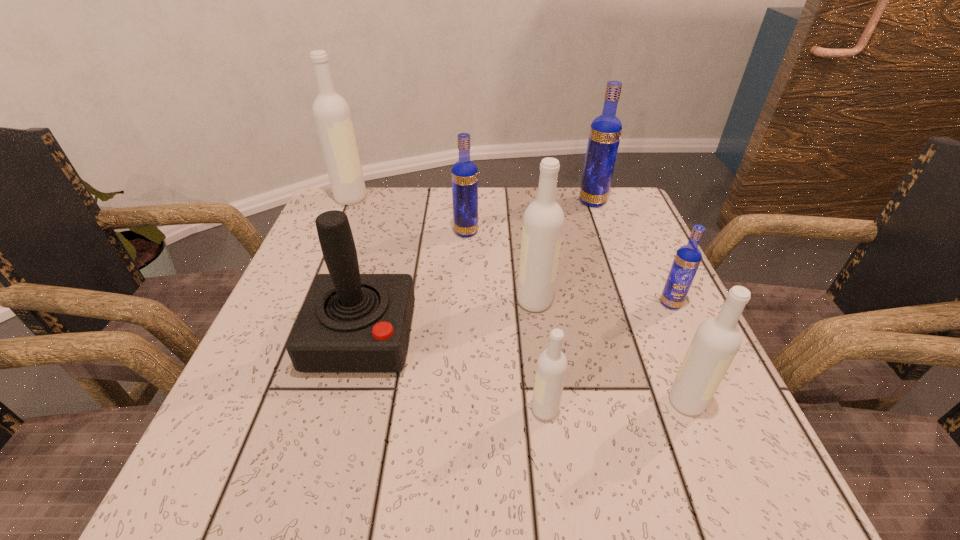
Locate an element on the screen. the rightmost blue vodka is located at coordinates [x=688, y=257].

Where is `the smallest white vodka`? the smallest white vodka is located at coordinates (551, 369).

At what (x,y) coordinates should I click in order to perform the action: click on blank space located 0.380m on the front of the tallest object. Please return your answer as a coordinate pair (x, y). Looking at the image, I should click on (302, 312).

Identify the location of vacant space located 0.210m on the front of the second blue vodka from left to right. (614, 261).

You are a GUI agent. You are given a task and a screenshot of the screen. Output one action in this format:
    pyautogui.click(x=<x>, y=<y>)
    Task: Click on the vacant area situated on the back of the second farthest white vodka
    Image resolution: width=960 pixels, height=540 pixels.
    Given the screenshot: What is the action you would take?
    pyautogui.click(x=525, y=232)

Where is `free space located on the base of the joystick`? The image size is (960, 540). free space located on the base of the joystick is located at coordinates (337, 428).

Identify the location of vacant space located on the right of the sixth vodka from right to left. This screenshot has width=960, height=540. (617, 232).

You are a GUI agent. You are given a task and a screenshot of the screen. Output one action in this format:
    pyautogui.click(x=<x>, y=<y>)
    Task: Click on the vacant space positioned 0.340m on the back of the rightmost white vodka
    The image size is (960, 540).
    Given the screenshot: What is the action you would take?
    [628, 258]

Identify the location of vacant region located 0.130m on the back of the smallest blue vodka. The image size is (960, 540). (649, 255).

Find the location of a particular element. The width and height of the screenshot is (960, 540). blank area located 0.060m on the left of the smallest white vodka is located at coordinates (492, 410).